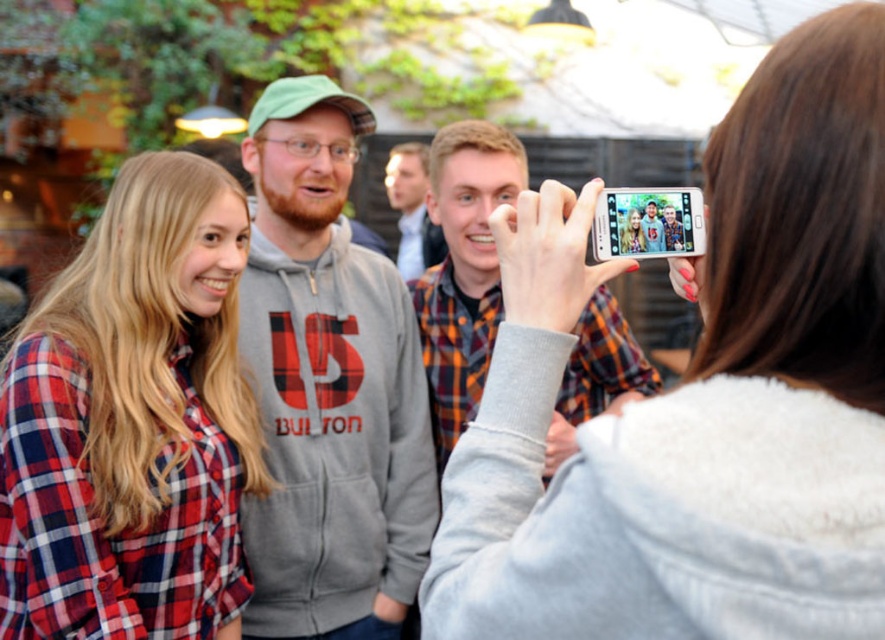
Can you confirm if white glossy phone at upper center is smaller than orange plaid shirt at center?

Correct, white glossy phone at upper center occupies less space than orange plaid shirt at center.

Who is more distant from viewer, (x=522, y=492) or (x=440, y=166)?

Point (x=440, y=166)

The height and width of the screenshot is (640, 885). Describe the element at coordinates (698, 394) in the screenshot. I see `white glossy phone at upper center` at that location.

I want to click on white glossy phone at upper center, so click(698, 394).

Can you confirm if orange plaid shirt at center is wider than flannel shirt at center?

Correct, the width of orange plaid shirt at center exceeds that of flannel shirt at center.

Who is higher up, orange plaid shirt at center or flannel shirt at center?

flannel shirt at center is above.

What do you see at coordinates (463, 268) in the screenshot? I see `orange plaid shirt at center` at bounding box center [463, 268].

Identify the location of orange plaid shirt at center. (463, 268).

Who is positioned more to the left, gray fleece hoodie at center or silver metallic phone at upper right?

Positioned to the left is gray fleece hoodie at center.

The width and height of the screenshot is (885, 640). Identify the location of gray fleece hoodie at center. (328, 387).